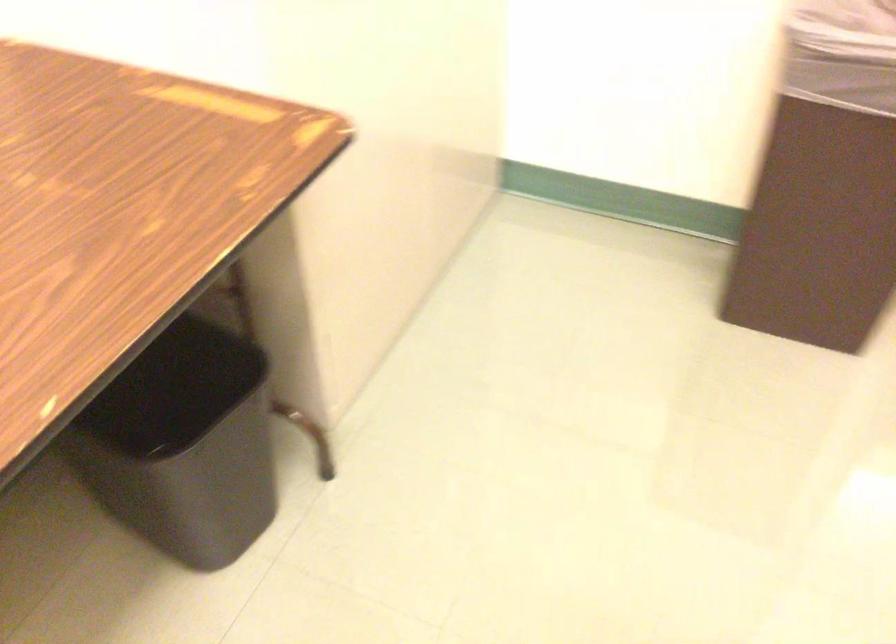
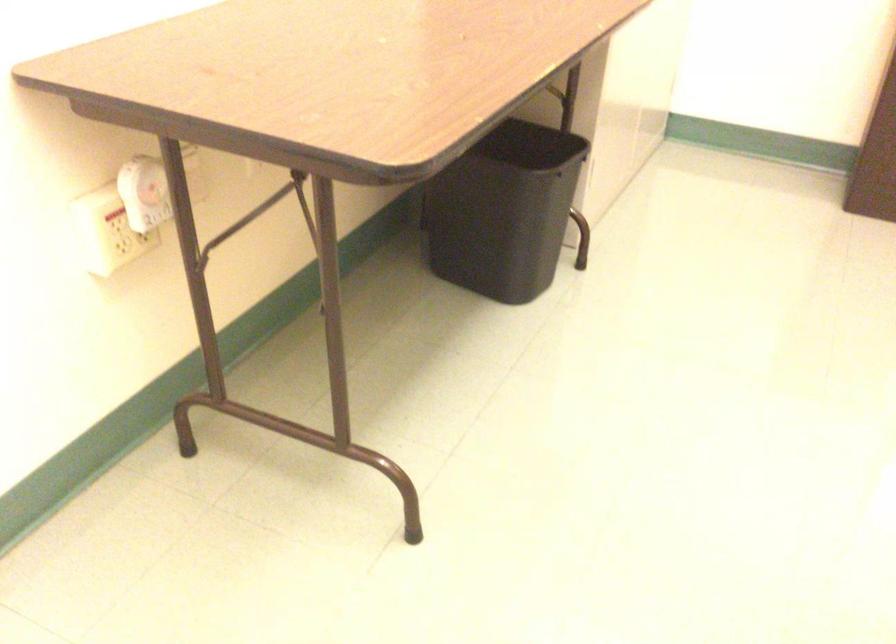
Where in the second image is the point corresponding to [156,480] from the first image?

(504, 211)